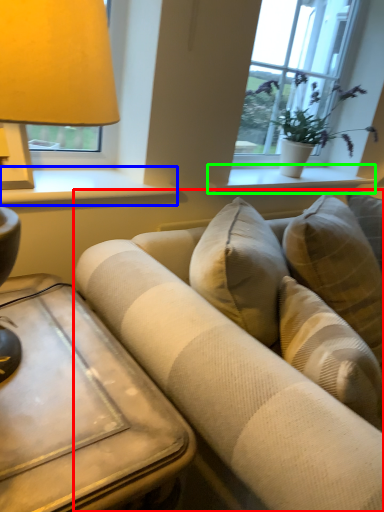
Question: Considering the real-world distances, which object is farthest from studio couch (highlighted by a red box)? window sill (highlighted by a blue box) or window sill (highlighted by a green box)?

Choices:
 (A) window sill
 (B) window sill

Answer: (B)